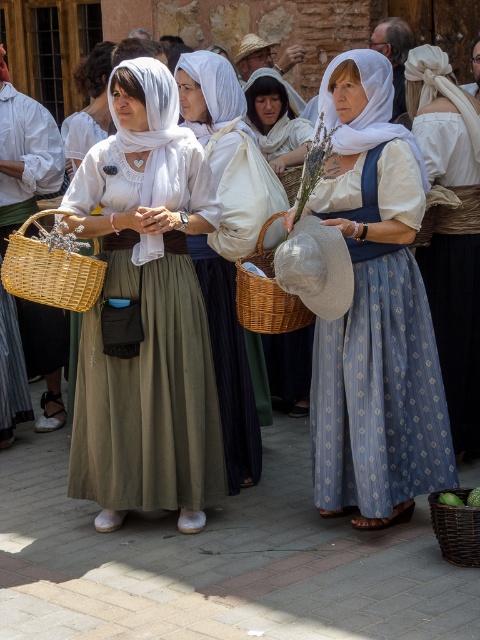
From the picture: Can you confirm if blue printed dress at center is positioned to the left of woven wicker basket at lower right?

Yes, blue printed dress at center is to the left of woven wicker basket at lower right.

Does point (370, 100) lie in front of point (457, 563)?

No, (370, 100) is further to viewer.

What do you see at coordinates (374, 314) in the screenshot? I see `blue printed dress at center` at bounding box center [374, 314].

The height and width of the screenshot is (640, 480). Identify the location of blue printed dress at center. (374, 314).

Find the location of a particular element. The width and height of the screenshot is (480, 640). woven wicker basket at lower right is located at coordinates (456, 531).

Is point (479, 515) less distant than point (289, 205)?

Yes, it is in front of point (289, 205).

Locate an element on the screen. The image size is (480, 640). woven wicker basket at lower right is located at coordinates 456,531.

Which is above, matte white scarf at center or woven wicker basket at center?

woven wicker basket at center is above.

Does matte white scarf at center have a smaller size compared to woven wicker basket at center?

Incorrect, matte white scarf at center is not smaller in size than woven wicker basket at center.

Does point (203, 84) lie behind point (259, 320)?

That is True.

The image size is (480, 640). In order to click on matte white scarf at center in this screenshot , I will do `click(228, 365)`.